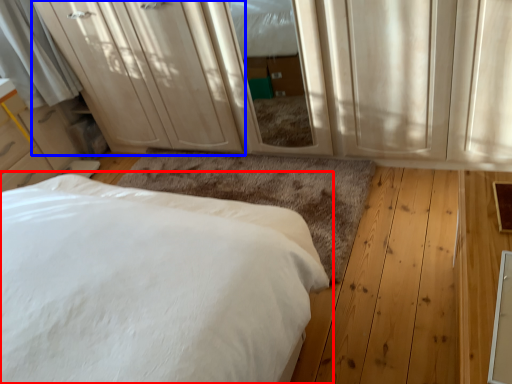
Question: Which point is closer to the camera, bed (highlighted by a red box) or dresser (highlighted by a blue box)?

Choices:
 (A) bed
 (B) dresser

Answer: (A)